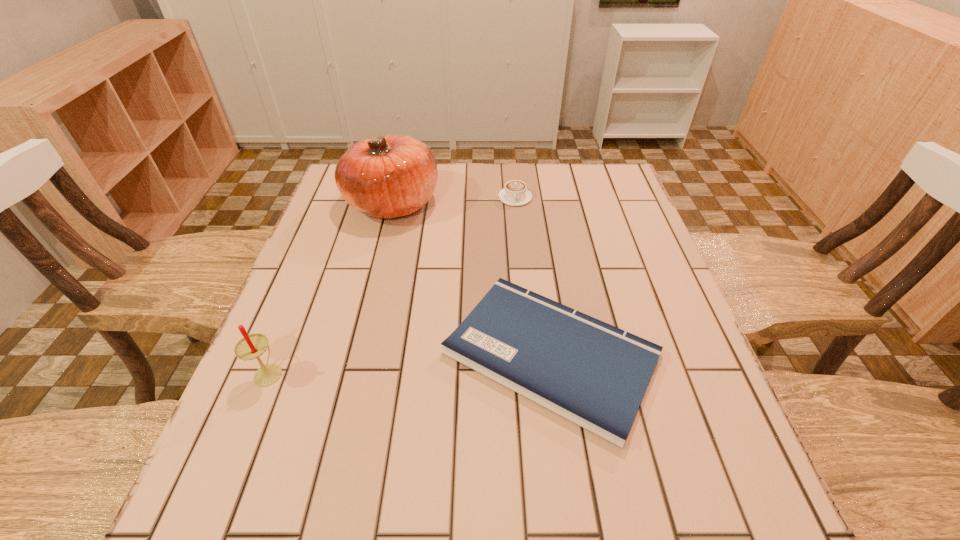
Select which object is the second closest to the tallest object. Please provide its 2D coordinates. Your answer should be formatted as a tuple, i.e. [(x, y)], where the tuple contains the x and y coordinates of a point satisfying the conditions above.

[(594, 374)]

This screenshot has height=540, width=960. Identify the location of vacant space that satisfies the following two spatial constraints: 1. on the back side of the third shortest object; 2. on the left side of the paperback book. [276, 354].